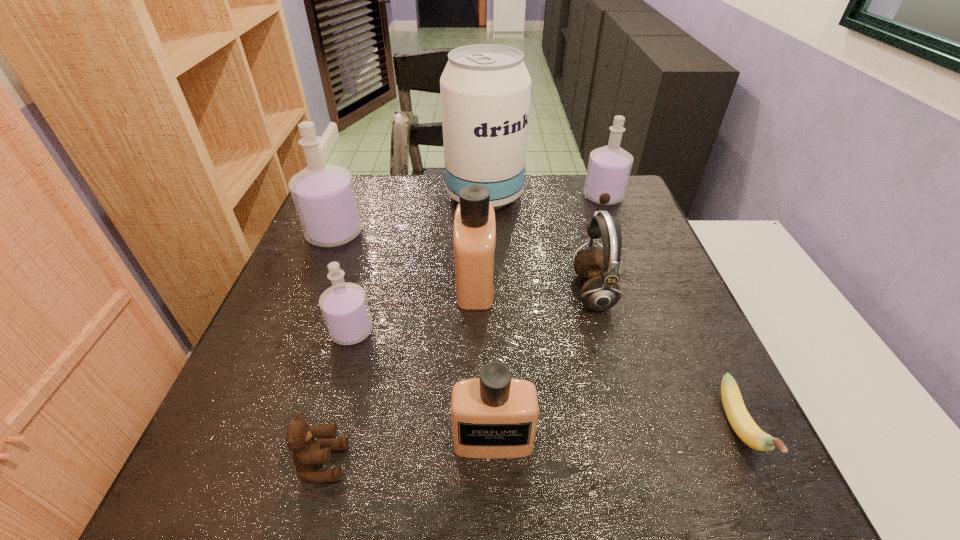
What are the coordinates of `blank space located on the ear pads of the brown earphone` in the screenshot? It's located at (419, 290).

You are a GUI agent. You are given a task and a screenshot of the screen. Output one action in this format:
    pyautogui.click(x=<x>, y=<y>)
    Task: Click on the free space located 0.340m on the ear pads of the brown earphone
    The height and width of the screenshot is (540, 960).
    Given the screenshot: What is the action you would take?
    pyautogui.click(x=423, y=290)

Locate an element on the screen. The height and width of the screenshot is (540, 960). free point located 0.130m on the ear pads of the brown earphone is located at coordinates (516, 290).

Where is `vacant area situated 0.110m on the back of the nearest purple perfume`? The width and height of the screenshot is (960, 540). vacant area situated 0.110m on the back of the nearest purple perfume is located at coordinates (366, 281).

Locate an element on the screen. The width and height of the screenshot is (960, 540). free space located on the front label of the smaller beige perfume is located at coordinates (494, 498).

Image resolution: width=960 pixels, height=540 pixels. Identify the location of vacant space located 0.260m on the face of the eighth tallest object. point(509,462).

Where is `alcohol situated at the far edge`? This screenshot has height=540, width=960. alcohol situated at the far edge is located at coordinates (485, 89).

Where is `perfume located in the near edge section of the desktop`? perfume located in the near edge section of the desktop is located at coordinates click(x=495, y=416).

You are a GUI agent. You are given a task and a screenshot of the screen. Output one action in this format:
    pyautogui.click(x=<x>, y=<y>)
    Task: Click on the teddy bear situated at the near edge
    
    Given the screenshot: What is the action you would take?
    pyautogui.click(x=307, y=453)

You are a GUI agent. You are given a task and a screenshot of the screen. Output one action in this format:
    pyautogui.click(x=<x>, y=<y>)
    Task: Click on the banana located at the near edge
    
    Given the screenshot: What is the action you would take?
    pyautogui.click(x=740, y=420)